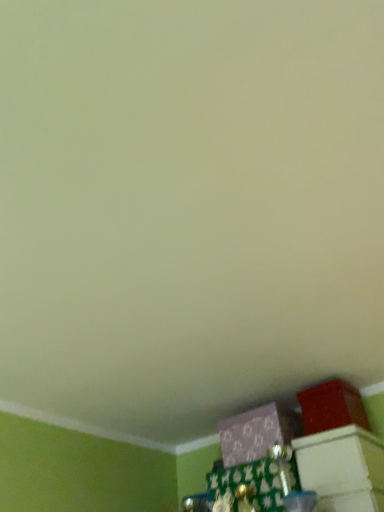
What is the approximate height of purple matte box at lower center, the second box when ordered from right to left?

The height of purple matte box at lower center, the second box when ordered from right to left, is 5.61 inches.

Describe the element at coordinates (258, 432) in the screenshot. This screenshot has height=512, width=384. I see `purple matte box at lower center, the second box when ordered from right to left` at that location.

What are the coordinates of `purple matte box at lower center, which ranks as the 1th box in left-to-right order` in the screenshot? It's located at pos(258,432).

The image size is (384, 512). What do you see at coordinates (331, 407) in the screenshot?
I see `matte red box at lower right, positioned as the 1th box in right-to-left order` at bounding box center [331, 407].

Where is `matte red box at lower right, positioned as the 1th box in right-to-left order`? matte red box at lower right, positioned as the 1th box in right-to-left order is located at coordinates (331, 407).

This screenshot has width=384, height=512. Identify the location of purple matte box at lower center, the second box when ordered from right to left. (258, 432).

Can you confirm if matte red box at lower right, positioned as the 1th box in right-to-left order, is positioned to the right of purple matte box at lower center, the second box when ordered from right to left?

Correct, you'll find matte red box at lower right, positioned as the 1th box in right-to-left order, to the right of purple matte box at lower center, the second box when ordered from right to left.

Is matte red box at lower right, arranged as the 2th box when viewed from the left, closer to camera compared to purple matte box at lower center, the second box when ordered from right to left?

Yes, it is.

Does point (368, 421) appear closer or farther from the camera than point (243, 441)?

Point (368, 421) appears to be farther away from the viewer than point (243, 441).

From the image's perspective, which one is positioned higher, matte red box at lower right, positioned as the 1th box in right-to-left order, or purple matte box at lower center, the second box when ordered from right to left?

From the image's view, matte red box at lower right, positioned as the 1th box in right-to-left order, is above.

From a real-world perspective, is matte red box at lower right, arranged as the 2th box when viewed from the left, positioned under purple matte box at lower center, the second box when ordered from right to left, based on gravity?

No, from a real-world perspective, matte red box at lower right, arranged as the 2th box when viewed from the left, is not below purple matte box at lower center, the second box when ordered from right to left.

Does matte red box at lower right, arranged as the 2th box when viewed from the left, have a greater width compared to purple matte box at lower center, which ranks as the 1th box in left-to-right order?

In fact, matte red box at lower right, arranged as the 2th box when viewed from the left, might be narrower than purple matte box at lower center, which ranks as the 1th box in left-to-right order.

Does matte red box at lower right, arranged as the 2th box when viewed from the left, have a lesser height compared to purple matte box at lower center, the second box when ordered from right to left?

No, matte red box at lower right, arranged as the 2th box when viewed from the left, is not shorter than purple matte box at lower center, the second box when ordered from right to left.

Is matte red box at lower right, arranged as the 2th box when viewed from the left, bigger or smaller than purple matte box at lower center, which ranks as the 1th box in left-to-right order?

matte red box at lower right, arranged as the 2th box when viewed from the left, is smaller than purple matte box at lower center, which ranks as the 1th box in left-to-right order.

Which is correct: matte red box at lower right, positioned as the 1th box in right-to-left order, is inside purple matte box at lower center, which ranks as the 1th box in left-to-right order, or outside of it?

matte red box at lower right, positioned as the 1th box in right-to-left order, is not inside purple matte box at lower center, which ranks as the 1th box in left-to-right order, it's outside.

Is there a large distance between matte red box at lower right, positioned as the 1th box in right-to-left order, and purple matte box at lower center, which ranks as the 1th box in left-to-right order?

matte red box at lower right, positioned as the 1th box in right-to-left order, is actually quite close to purple matte box at lower center, which ranks as the 1th box in left-to-right order.

Is matte red box at lower right, positioned as the 1th box in right-to-left order, oriented away from purple matte box at lower center, which ranks as the 1th box in left-to-right order?

That's not correct — matte red box at lower right, positioned as the 1th box in right-to-left order, is not looking away from purple matte box at lower center, which ranks as the 1th box in left-to-right order.

Can you tell me how much matte red box at lower right, positioned as the 1th box in right-to-left order, and purple matte box at lower center, the second box when ordered from right to left, differ in facing direction?

0.000209 degrees.

Could you measure the distance between matte red box at lower right, positioned as the 1th box in right-to-left order, and purple matte box at lower center, the second box when ordered from right to left?

matte red box at lower right, positioned as the 1th box in right-to-left order, is 5.68 inches from purple matte box at lower center, the second box when ordered from right to left.

In the image, there is a purple matte box at lower center, which ranks as the 1th box in left-to-right order. Identify the location of box above it (from the image's perspective). This screenshot has width=384, height=512. (331, 407).

Based on the photo, does purple matte box at lower center, the second box when ordered from right to left, appear on the left side of matte red box at lower right, arranged as the 2th box when viewed from the left?

Indeed, purple matte box at lower center, the second box when ordered from right to left, is positioned on the left side of matte red box at lower right, arranged as the 2th box when viewed from the left.

Considering the positions of objects purple matte box at lower center, which ranks as the 1th box in left-to-right order, and matte red box at lower right, positioned as the 1th box in right-to-left order, in the image provided, who is behind, purple matte box at lower center, which ranks as the 1th box in left-to-right order, or matte red box at lower right, positioned as the 1th box in right-to-left order,?

purple matte box at lower center, which ranks as the 1th box in left-to-right order, is behind.

Considering the points (300, 424) and (319, 425), which point is in front, point (300, 424) or point (319, 425)?

Positioned in front is point (319, 425).

From the image's perspective, which is below, purple matte box at lower center, the second box when ordered from right to left, or matte red box at lower right, positioned as the 1th box in right-to-left order?

purple matte box at lower center, the second box when ordered from right to left, is shown below in the image.

From a real-world perspective, relative to matte red box at lower right, arranged as the 2th box when viewed from the left, is purple matte box at lower center, the second box when ordered from right to left, vertically above or below?

In terms of real-world spatial position, purple matte box at lower center, the second box when ordered from right to left, is below matte red box at lower right, arranged as the 2th box when viewed from the left.

Which object is thinner, purple matte box at lower center, which ranks as the 1th box in left-to-right order, or matte red box at lower right, arranged as the 2th box when viewed from the left?

matte red box at lower right, arranged as the 2th box when viewed from the left.

Based on the photo, which of these two, purple matte box at lower center, the second box when ordered from right to left, or matte red box at lower right, positioned as the 1th box in right-to-left order, stands taller?

Standing taller between the two is matte red box at lower right, positioned as the 1th box in right-to-left order.

Considering the sizes of purple matte box at lower center, the second box when ordered from right to left, and matte red box at lower right, arranged as the 2th box when viewed from the left, in the image, is purple matte box at lower center, the second box when ordered from right to left, bigger or smaller than matte red box at lower right, arranged as the 2th box when viewed from the left,?

Considering their sizes, purple matte box at lower center, the second box when ordered from right to left, takes up more space than matte red box at lower right, arranged as the 2th box when viewed from the left.

Can we say purple matte box at lower center, the second box when ordered from right to left, lies outside matte red box at lower right, positioned as the 1th box in right-to-left order?

purple matte box at lower center, the second box when ordered from right to left, lies outside matte red box at lower right, positioned as the 1th box in right-to-left order,'s area.

Is purple matte box at lower center, which ranks as the 1th box in left-to-right order, far away from matte red box at lower right, arranged as the 2th box when viewed from the left?

No, there isn't a large distance between purple matte box at lower center, which ranks as the 1th box in left-to-right order, and matte red box at lower right, arranged as the 2th box when viewed from the left.

From the picture: Is matte red box at lower right, arranged as the 2th box when viewed from the left, at the back of purple matte box at lower center, which ranks as the 1th box in left-to-right order?

That's not correct — purple matte box at lower center, which ranks as the 1th box in left-to-right order, is not looking away from matte red box at lower right, arranged as the 2th box when viewed from the left.

How different are the orientations of purple matte box at lower center, the second box when ordered from right to left, and matte red box at lower right, positioned as the 1th box in right-to-left order, in degrees?

The angle between the facing direction of purple matte box at lower center, the second box when ordered from right to left, and the facing direction of matte red box at lower right, positioned as the 1th box in right-to-left order, is 0.000209 degrees.

Identify the location of box that appears below the matte red box at lower right, arranged as the 2th box when viewed from the left (from the image's perspective). click(x=258, y=432).

The image size is (384, 512). I want to click on box to the right of purple matte box at lower center, the second box when ordered from right to left, so click(331, 407).

In order to click on box below the matte red box at lower right, arranged as the 2th box when viewed from the left (from a real-world perspective) in this screenshot , I will do `click(258, 432)`.